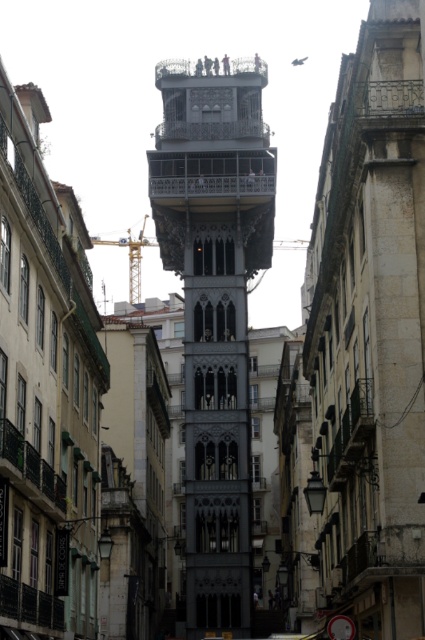
Question: Can you confirm if gray stone bell tower at center is positioned below yellow metallic crane at center?

Choices:
 (A) yes
 (B) no

Answer: (A)

Question: Which object appears farthest from the camera in this image?

Choices:
 (A) gray stone bell tower at center
 (B) yellow metallic crane at center

Answer: (B)

Question: Is gray stone bell tower at center smaller than yellow metallic crane at center?

Choices:
 (A) no
 (B) yes

Answer: (A)

Question: Which point is closer to the camera?

Choices:
 (A) gray stone bell tower at center
 (B) yellow metallic crane at center

Answer: (A)

Question: Does gray stone bell tower at center appear on the left side of yellow metallic crane at center?

Choices:
 (A) yes
 (B) no

Answer: (B)